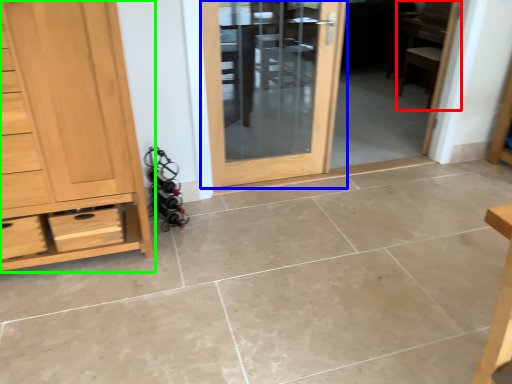
Question: Estimate the real-world distances between objects in this image. Which object is farther from chair (highlighted by a red box), door (highlighted by a blue box) or chest of drawers (highlighted by a green box)?

Choices:
 (A) door
 (B) chest of drawers

Answer: (B)